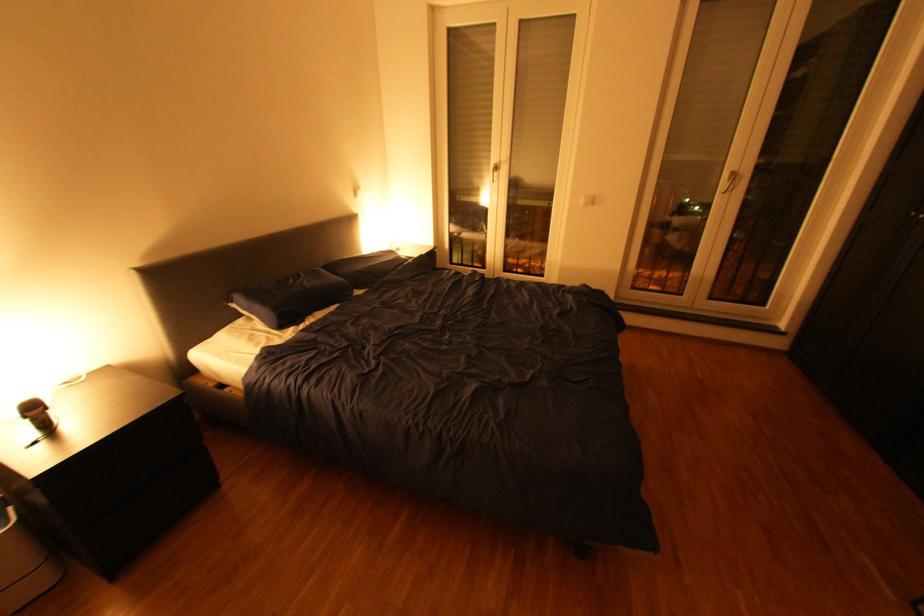
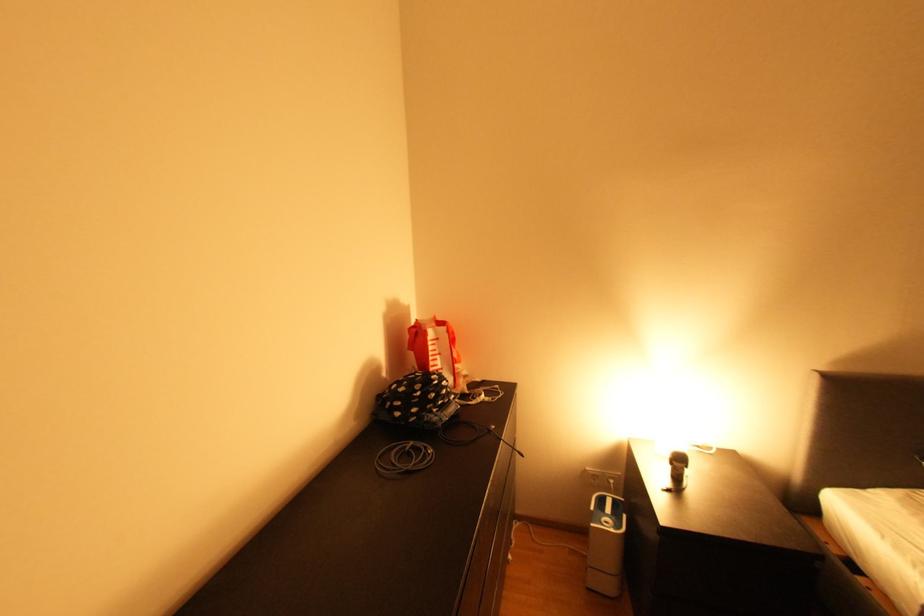
Question: The camera is either moving clockwise (left) or counter-clockwise (right) around the object. The first image is from the beginning of the video and the second image is from the end. Is the camera moving left or right when shooting the video?

Choices:
 (A) Left
 (B) Right

Answer: (B)